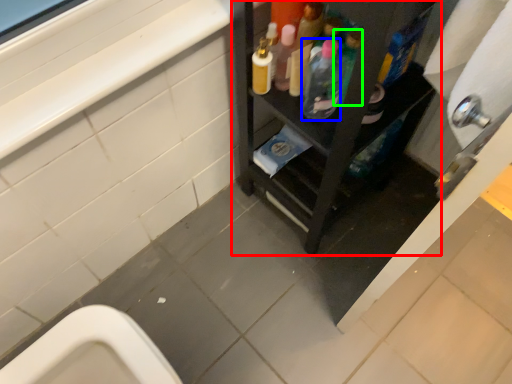
Question: Estimate the real-world distances between objects in this image. Which object is closer to furniture (highlighted by a red box), bottle (highlighted by a blue box) or bottle (highlighted by a green box)?

Choices:
 (A) bottle
 (B) bottle

Answer: (A)